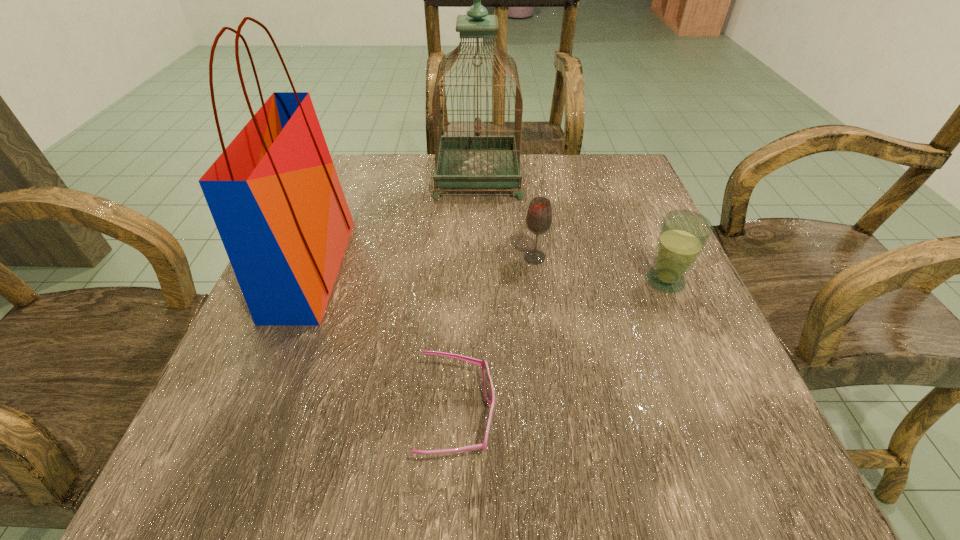
The width and height of the screenshot is (960, 540). Find the location of `birdcage`. birdcage is located at coordinates (461, 161).

Find the location of a particular element. This screenshot has width=960, height=540. the leftmost object is located at coordinates (274, 194).

Locate an element on the screen. the nearer glass drink container is located at coordinates (683, 235).

You are a GUI agent. You are given a task and a screenshot of the screen. Output one action in this format:
    pyautogui.click(x=<x>, y=<y>)
    Task: Click on the rightmost object
    
    Given the screenshot: What is the action you would take?
    pyautogui.click(x=683, y=235)

Where is `the left glass drink container`? The image size is (960, 540). the left glass drink container is located at coordinates (539, 216).

The image size is (960, 540). Find the location of `sunglasses`. sunglasses is located at coordinates (488, 386).

You are a GUI agent. You are given a task and a screenshot of the screen. Output one action in this format:
    pyautogui.click(x=<x>, y=<y>)
    Task: Click on the nearest object
    
    Given the screenshot: What is the action you would take?
    pyautogui.click(x=488, y=386)

Locate an element on the screen. blank space located 0.270m at the door of the farthest object is located at coordinates (633, 176).

Locate an element on the screen. The height and width of the screenshot is (540, 960). vacant space situated on the handle side of the leftmost object is located at coordinates (530, 268).

This screenshot has height=540, width=960. What are the coordinates of `vacant space located on the back of the rightmost object` in the screenshot? It's located at click(x=623, y=183).